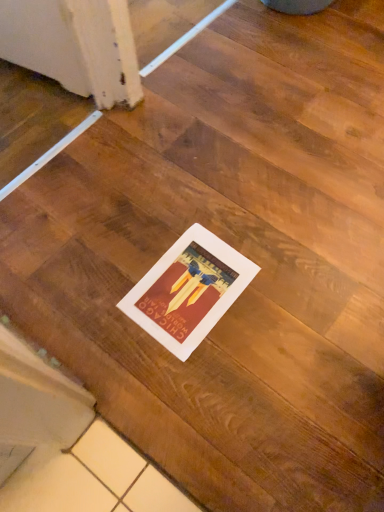
Where is `free location to the left of matte paper poster at center`? Image resolution: width=384 pixels, height=512 pixels. free location to the left of matte paper poster at center is located at coordinates (97, 291).